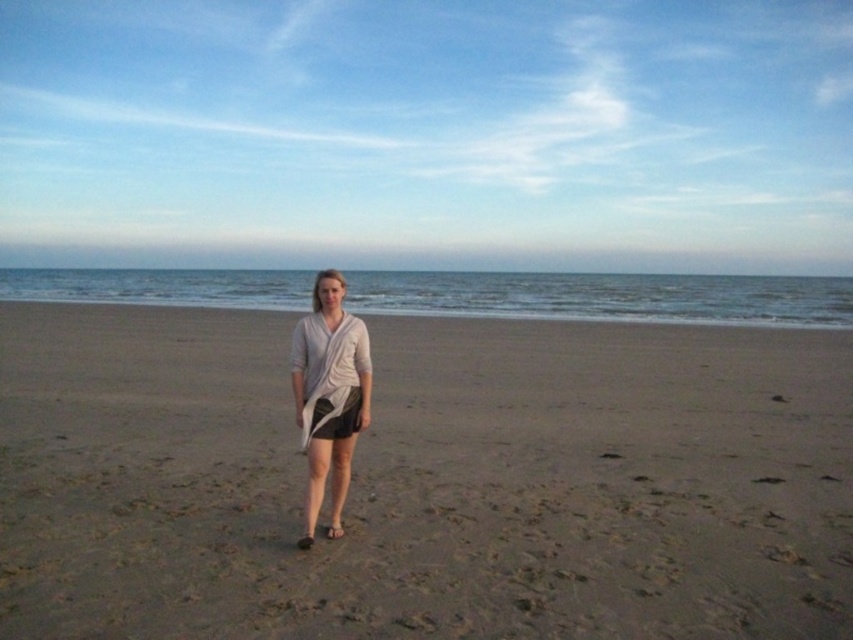
You are standing on the brown sandy beach at center and want to reach the light gray draped fabric at center. Which direction should you move to get closer to the fabric?

The brown sandy beach at center is positioned on the left side of light gray draped fabric at center, so you should move to the right to get closer to the fabric.